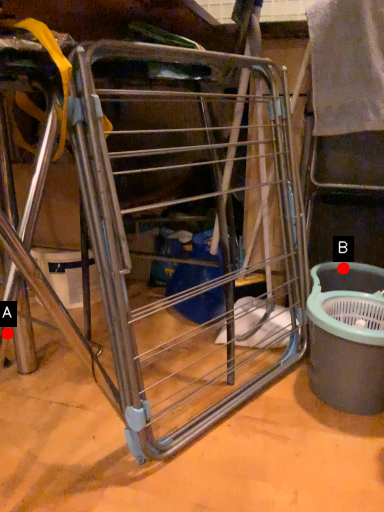
Question: Two points are circled on the image, labeled by A and B beside each circle. Which point is closer to the camera?

Choices:
 (A) A is closer
 (B) B is closer

Answer: (A)